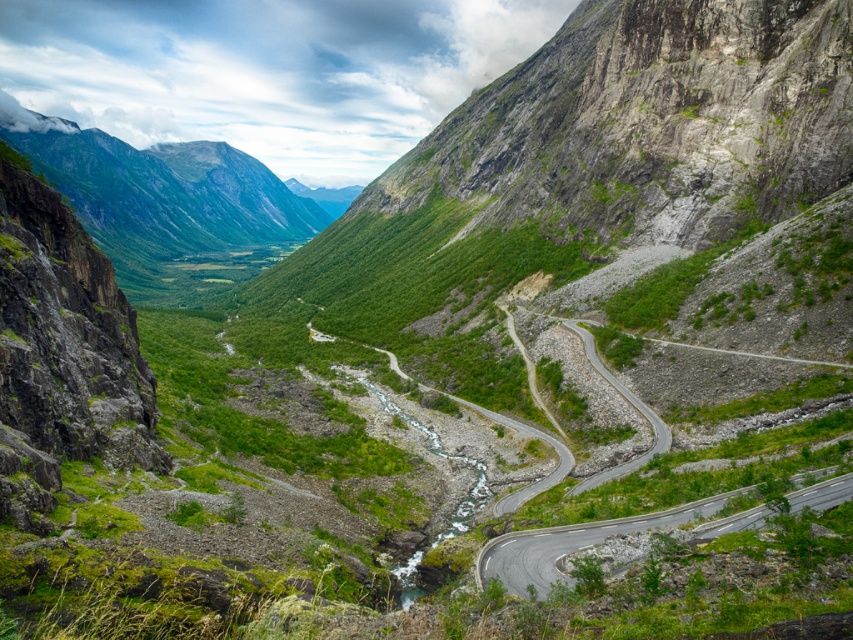
You are a hiker trying to reach the highest point in the image. You have two options to climb from the gray asphalt road at lower right to the green grassy mountain at upper left. Which path would you choose to reach the summit faster?

The green grassy mountain at upper left is much taller than the gray asphalt road at lower right, so the path leading directly to the mountain would be steeper but potentially shorter in distance. However, climbing a taller mountain requires more effort and time, so it might not be faster. Alternatively, taking a gradual path along the gray asphalt road at lower right might be slower but safer. Without specific path details, it is hard to determine the fastest route. However, the question asks to choose one

You are a hiker planning to take a photo of the gray asphalt road at lower right and the green grassy mountain at upper left. Which object should you focus on first if you want to capture both in a single frame without moving your camera?

You should focus on the green grassy mountain at upper left first because it is wider than the gray asphalt road at lower right, so it will occupy more space in the frame.

You are a hiker standing at the gray asphalt road at lower right and want to reach the green grassy mountain at upper left. Which direction should you move to get closer to the mountain?

You should move towards the upper left direction to get closer to the green grassy mountain at upper left since it is located in that direction and further away from the gray asphalt road at lower right.